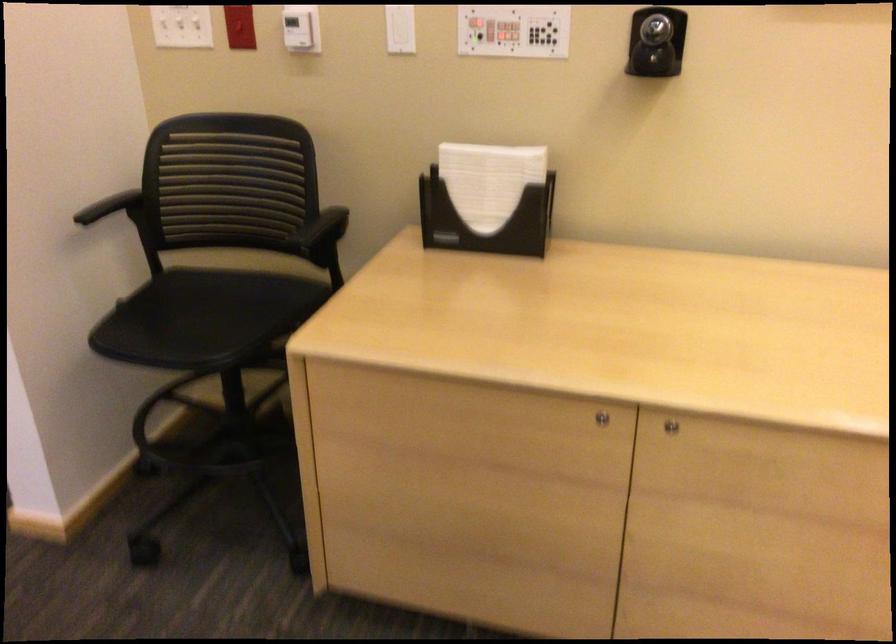
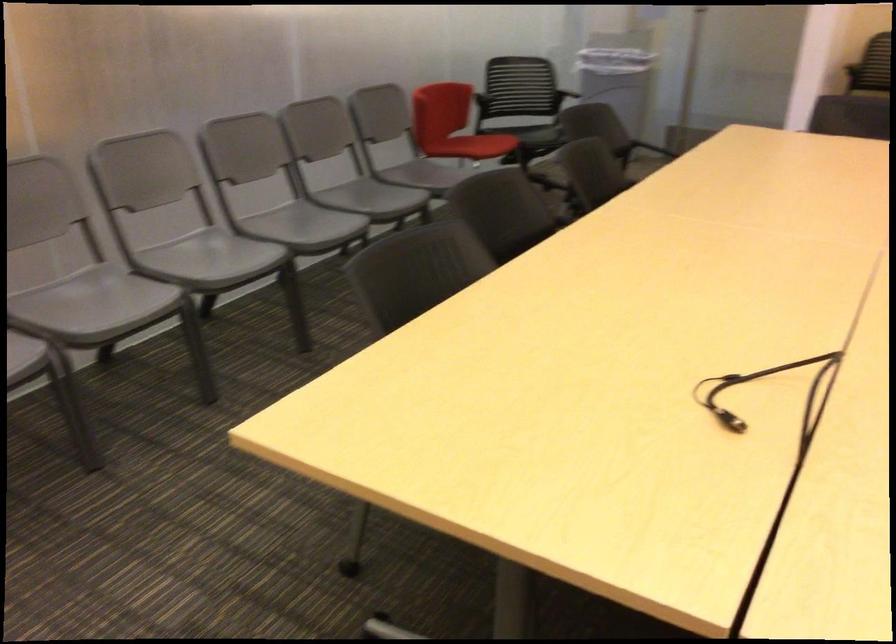
Question: In a continuous first-person perspective shot, in which direction is the camera moving?

Choices:
 (A) Left
 (B) Right
 (C) Forward
 (D) Backward

Answer: (D)